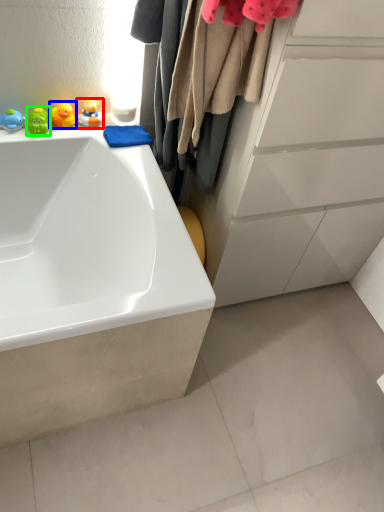
Question: Which is farther away from toy (highlighted by a red box)? toy (highlighted by a blue box) or toy (highlighted by a green box)?

Choices:
 (A) toy
 (B) toy

Answer: (B)